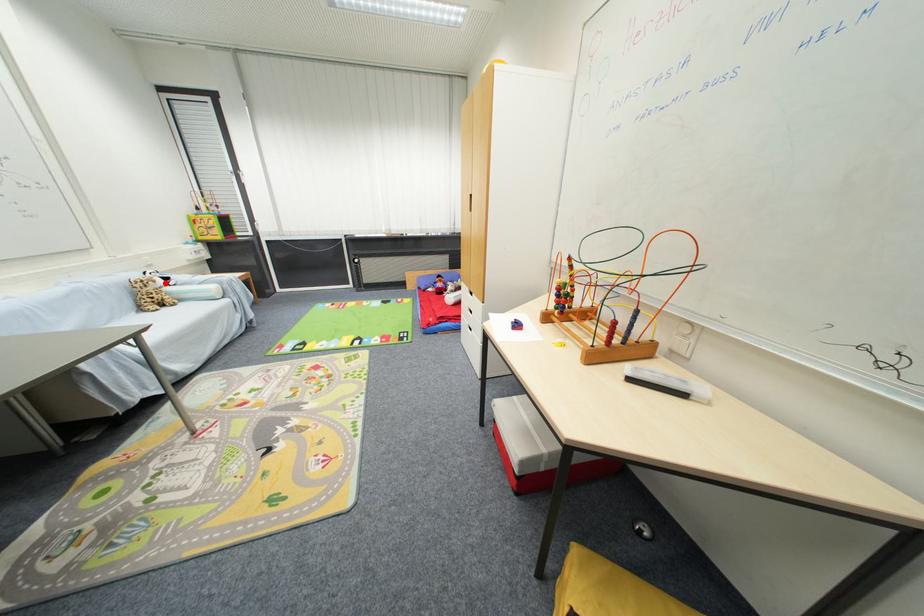
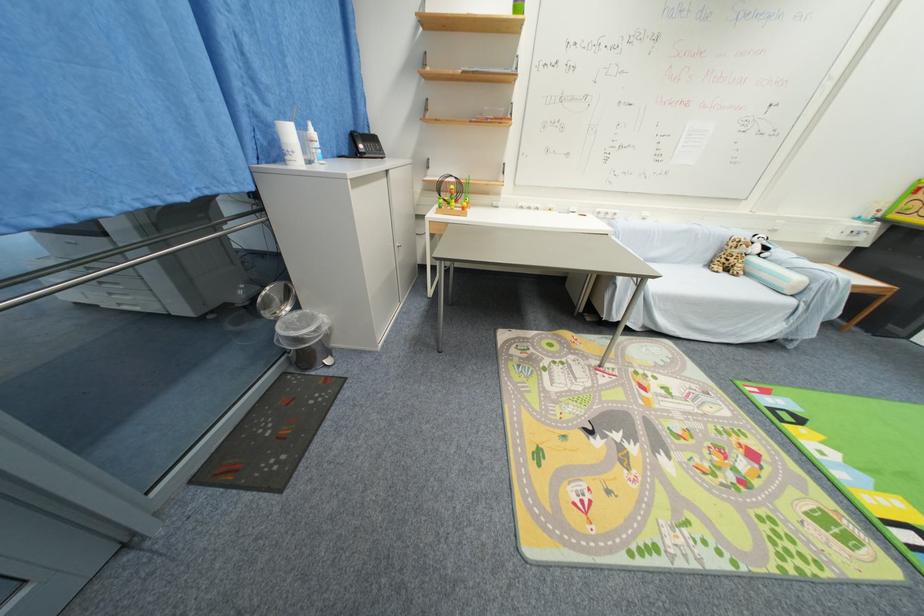
Find the pixel in the second image that matches the highlighted location in the first image.

(761, 251)